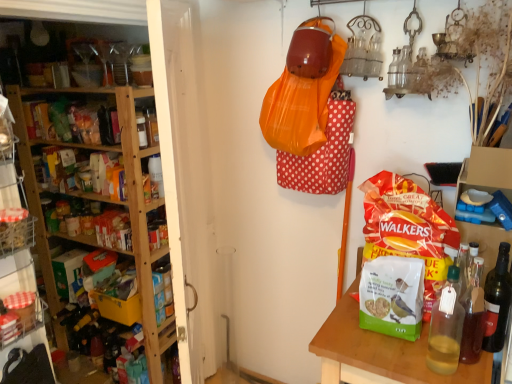
The height and width of the screenshot is (384, 512). In order to click on vacant space situated on the left part of translucent glass bottle at right, the first bottle positioned from the right in this screenshot , I will do `click(426, 354)`.